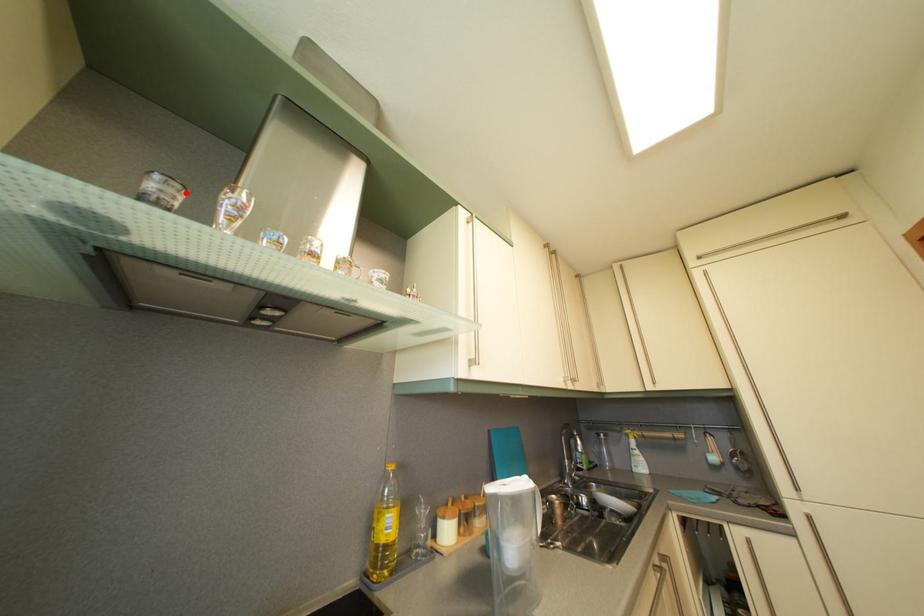
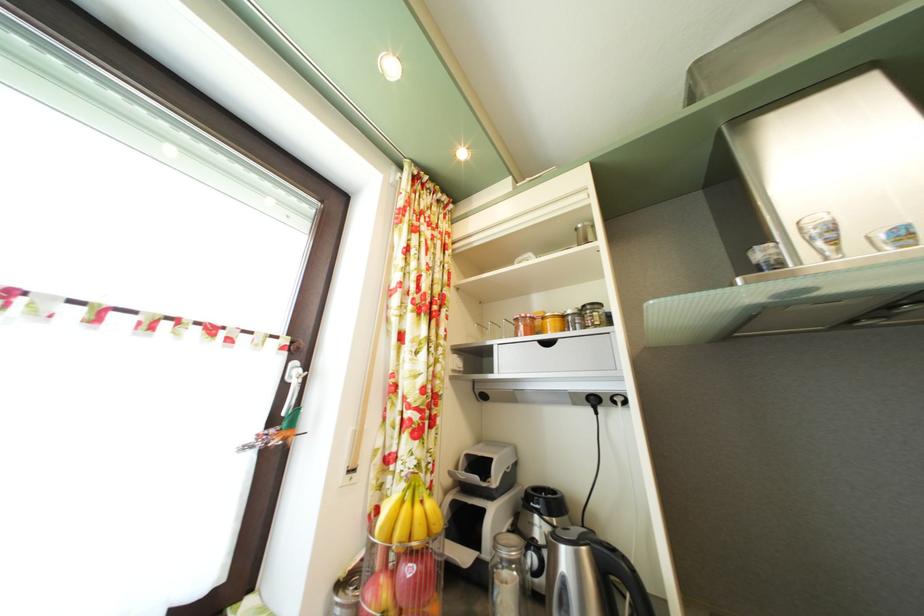
Find the pixel in the second image that matches the highlighted location in the first image.

(781, 252)